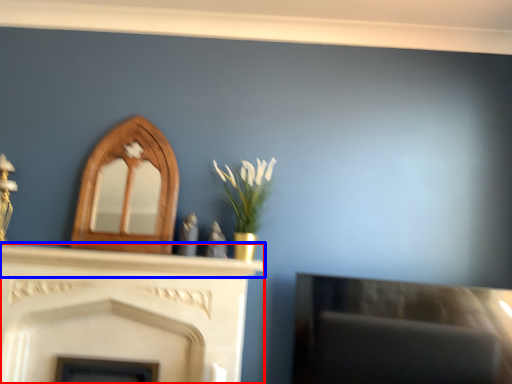
Question: Which object is closer to the camera taking this photo, fireplace (highlighted by a red box) or mantle (highlighted by a blue box)?

Choices:
 (A) fireplace
 (B) mantle

Answer: (A)